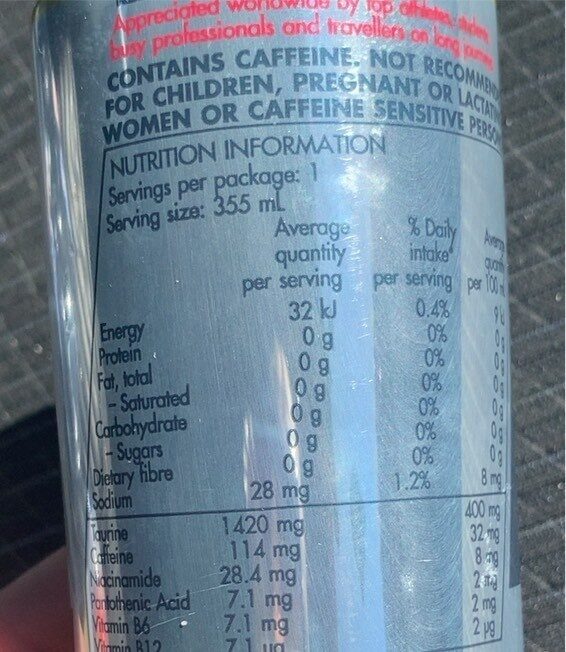
This screenshot has width=566, height=652. What are the coordinates of `tiles` in the screenshot? It's located at (544, 541), (541, 476), (544, 434).